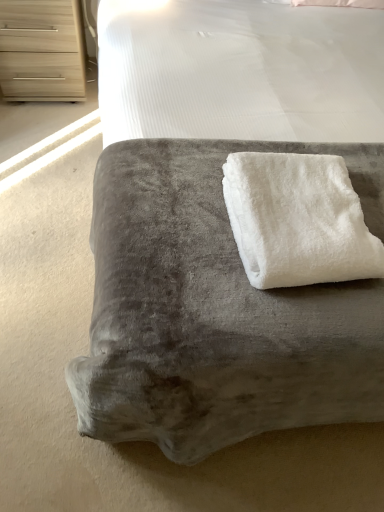
The height and width of the screenshot is (512, 384). In order to click on vacant area that lies in front of white fluffy towel at center in this screenshot , I will do `click(264, 314)`.